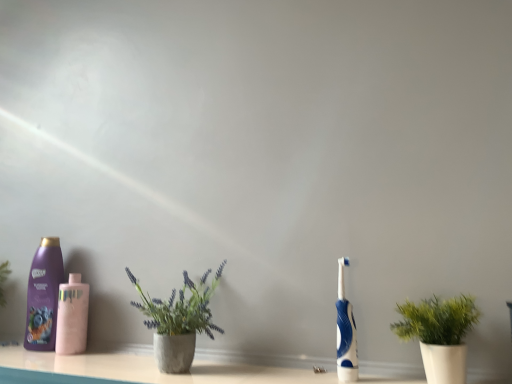
Question: Considering the relative positions of concrete textured pot at center, the first houseplant when ordered from left to right, and blue rubber toothbrush at right in the image provided, is concrete textured pot at center, the first houseplant when ordered from left to right, to the left of blue rubber toothbrush at right from the viewer's perspective?

Choices:
 (A) yes
 (B) no

Answer: (A)

Question: Is the depth of concrete textured pot at center, the first houseplant when ordered from left to right, greater than that of blue rubber toothbrush at right?

Choices:
 (A) yes
 (B) no

Answer: (B)

Question: Would you say blue rubber toothbrush at right is part of concrete textured pot at center, which ranks as the second houseplant in right-to-left order,'s contents?

Choices:
 (A) yes
 (B) no

Answer: (B)

Question: Is concrete textured pot at center, which ranks as the second houseplant in right-to-left order, wider than blue rubber toothbrush at right?

Choices:
 (A) no
 (B) yes

Answer: (B)

Question: From the image's perspective, is concrete textured pot at center, which ranks as the second houseplant in right-to-left order, on top of blue rubber toothbrush at right?

Choices:
 (A) yes
 (B) no

Answer: (A)

Question: Considering the positions of point (181, 360) and point (61, 314), is point (181, 360) closer or farther from the camera than point (61, 314)?

Choices:
 (A) closer
 (B) farther

Answer: (A)

Question: Do you think concrete textured pot at center, which ranks as the second houseplant in right-to-left order, is within pink matte bottle at left, the second bottle positioned from the left, or outside of it?

Choices:
 (A) outside
 (B) inside

Answer: (A)

Question: In terms of width, does concrete textured pot at center, the first houseplant when ordered from left to right, look wider or thinner when compared to pink matte bottle at left, the 1th bottle from the right?

Choices:
 (A) wide
 (B) thin

Answer: (A)

Question: In terms of size, does concrete textured pot at center, the first houseplant when ordered from left to right, appear bigger or smaller than pink matte bottle at left, the second bottle positioned from the left?

Choices:
 (A) big
 (B) small

Answer: (A)

Question: From the image's perspective, is green matte plant at right, placed as the first houseplant when sorted from right to left, above or below blue rubber toothbrush at right?

Choices:
 (A) above
 (B) below

Answer: (B)

Question: Considering the positions of green matte plant at right, the 2th houseplant when ordered from left to right, and blue rubber toothbrush at right in the image, is green matte plant at right, the 2th houseplant when ordered from left to right, taller or shorter than blue rubber toothbrush at right?

Choices:
 (A) short
 (B) tall

Answer: (A)

Question: Considering their positions, is green matte plant at right, the 2th houseplant when ordered from left to right, located in front of or behind blue rubber toothbrush at right?

Choices:
 (A) behind
 (B) front

Answer: (B)

Question: Based on their sizes in the image, would you say green matte plant at right, placed as the first houseplant when sorted from right to left, is bigger or smaller than blue rubber toothbrush at right?

Choices:
 (A) small
 (B) big

Answer: (B)

Question: Is purple glossy shampoo at left, which appears as the second bottle when viewed from the right, in front of or behind blue rubber toothbrush at right in the image?

Choices:
 (A) front
 (B) behind

Answer: (B)

Question: Is purple glossy shampoo at left, which appears as the second bottle when viewed from the right, wider or thinner than blue rubber toothbrush at right?

Choices:
 (A) thin
 (B) wide

Answer: (B)